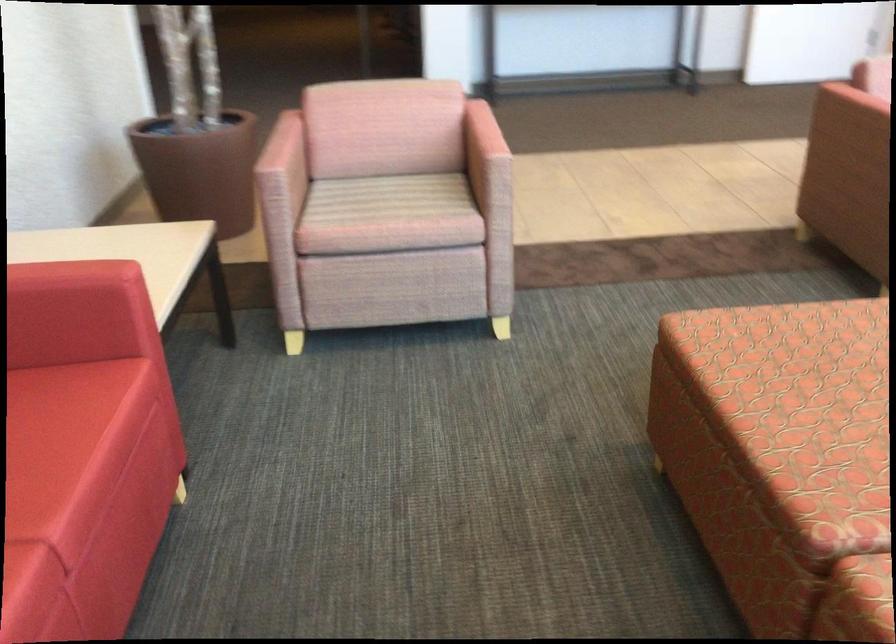
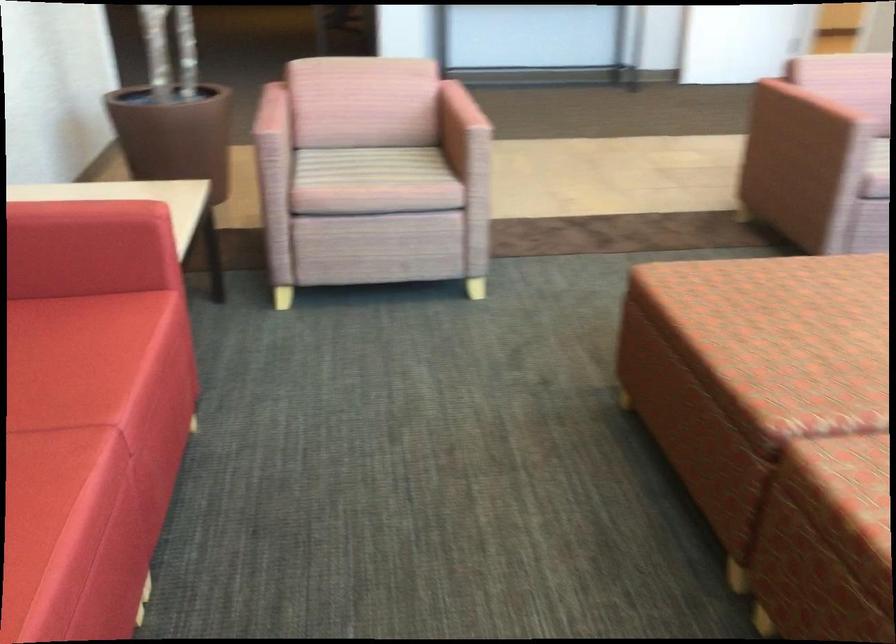
What movement of the cameraman would produce the second image?

The cameraman walked toward left, backward.